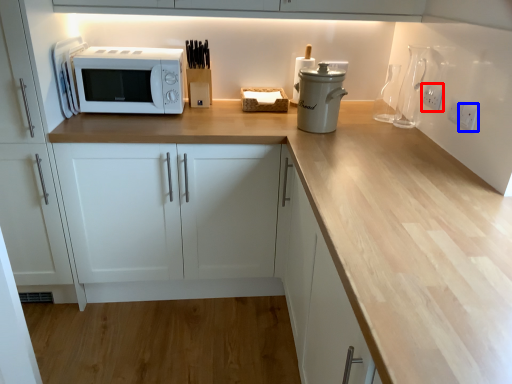
Question: Which object is further to the camera taking this photo, electric outlet (highlighted by a red box) or electric outlet (highlighted by a blue box)?

Choices:
 (A) electric outlet
 (B) electric outlet

Answer: (A)